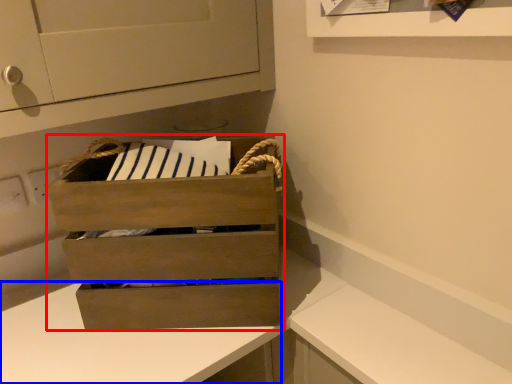
Question: Which point is closer to the camera, chest of drawers (highlighted by a red box) or counter (highlighted by a blue box)?

Choices:
 (A) chest of drawers
 (B) counter

Answer: (B)